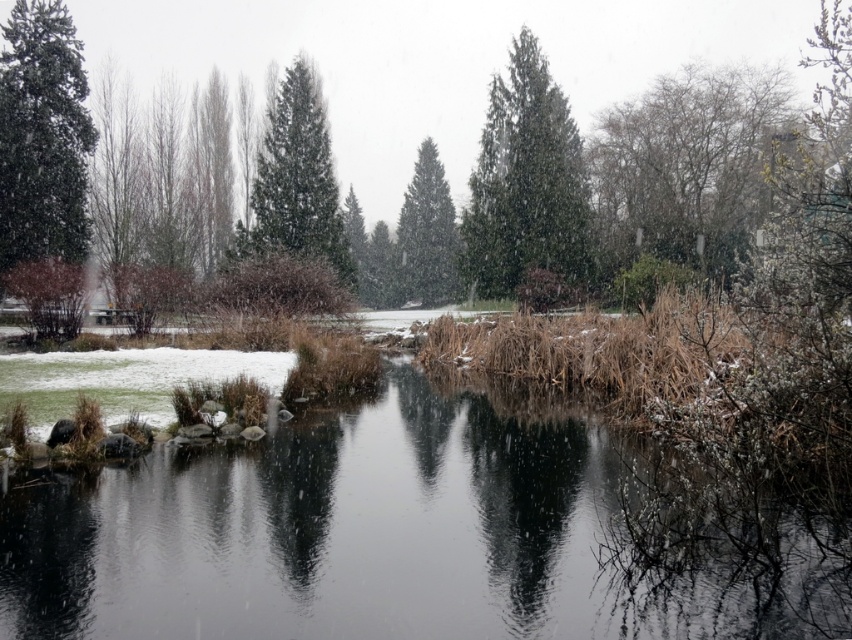
Looking at this image, you are an ornithologist observing birds in the winter scene. You notice two trees in the image. One is the bare branches at upper right and the other is the green matte tree at center. Which of these trees is positioned higher in the image?

The bare branches at upper right is positioned higher in the image than the green matte tree at center.

Consider the image. You are standing at the center of the winter scene and see the point marked as point (527,182). What is the nearest object to you at that point?

The nearest object to you at point (527,182) is the green textured evergreen tree at center.